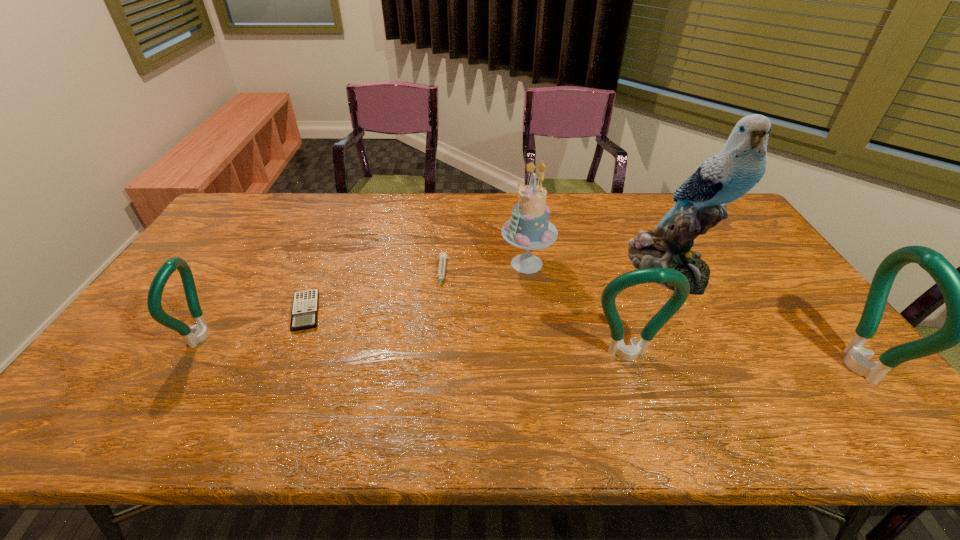
Locate an element on the screen. The height and width of the screenshot is (540, 960). the second object from right to left is located at coordinates (739, 166).

Locate an element on the screen. Image resolution: width=960 pixels, height=540 pixels. the fourth object from right to left is located at coordinates pyautogui.click(x=529, y=228).

At what (x,y) coordinates should I click in order to perform the action: click on vacant space located at the jaws of the leftmost bottle opener. Please return your answer as a coordinate pair (x, y). Looking at the image, I should click on (242, 337).

Locate an element on the screen. vacant space situated 0.050m at the jaws of the rightmost object is located at coordinates (816, 366).

The width and height of the screenshot is (960, 540). Identify the location of free spot located at the jaws of the rightmost object. (713, 366).

Image resolution: width=960 pixels, height=540 pixels. In order to click on vacant space located 0.350m at the jaws of the rightmost object in this screenshot , I will do `click(693, 366)`.

Find the location of `vacant space situated 0.230m at the needle end of the second shortest object`. vacant space situated 0.230m at the needle end of the second shortest object is located at coordinates (434, 356).

Where is `free point located 0.260m on the right of the calculator`? The width and height of the screenshot is (960, 540). free point located 0.260m on the right of the calculator is located at coordinates (418, 312).

The height and width of the screenshot is (540, 960). I want to click on free spot located 0.210m on the face of the tallest object, so click(714, 358).

Find the location of a particular element. This screenshot has height=540, width=960. free location located with a ladder on the side of the fourth object from right to left is located at coordinates (420, 264).